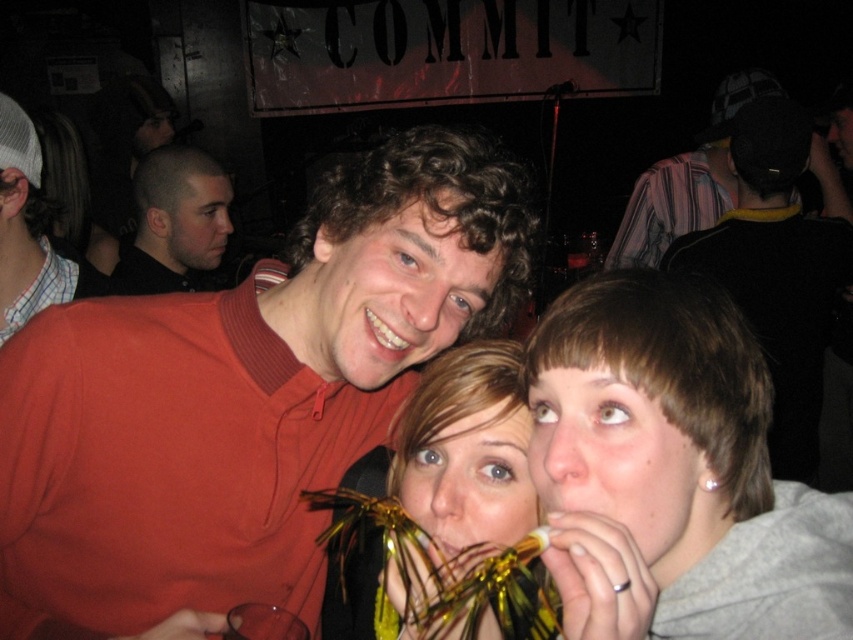
Which is above, matte red sweater at center or striped fabric shirt at upper right?

striped fabric shirt at upper right

How distant is matte red sweater at center from striped fabric shirt at upper right?

1.75 meters

Is point (252, 472) more distant than point (669, 234)?

No.

Find the location of `matte red sweater at center`. matte red sweater at center is located at coordinates (242, 396).

Who is positioned more to the left, shiny gold foil at center or matte red sweater at left?

matte red sweater at left

Which of these two, shiny gold foil at center or matte red sweater at left, stands taller?

Standing taller between the two is matte red sweater at left.

Is point (451, 497) positioned before point (28, 280)?

Yes, it is in front of point (28, 280).

Find the location of a particular element. This screenshot has width=853, height=640. shiny gold foil at center is located at coordinates (459, 440).

From the picture: Is black knit cap at upper right bigger than matte red sweater at left?

Yes.

Is black knit cap at upper right in front of matte red sweater at left?

No, it is not.

Which is in front, point (758, 116) or point (38, 234)?

Point (38, 234) is more forward.

The width and height of the screenshot is (853, 640). In order to click on black knit cap at upper right in this screenshot , I will do `click(776, 269)`.